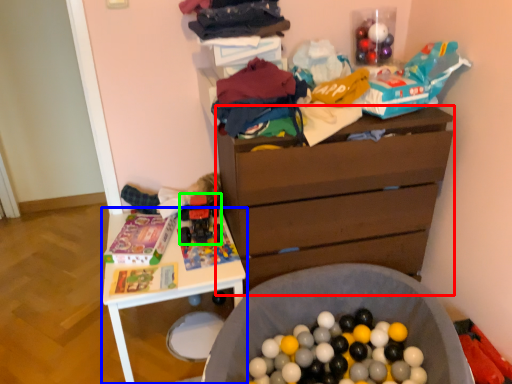
Question: Based on their relative distances, which object is nearer to chest of drawers (highlighted by a red box)? Choose from table (highlighted by a blue box) and toy (highlighted by a green box).

Choices:
 (A) table
 (B) toy

Answer: (A)